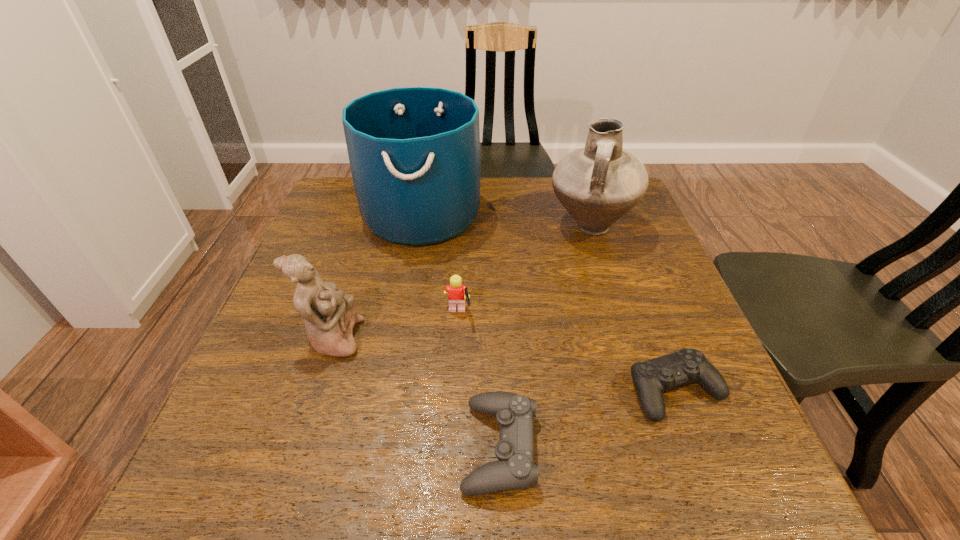
Locate an element on the screen. bucket is located at coordinates (414, 152).

You are a GUI agent. You are given a task and a screenshot of the screen. Output one action in this format:
    pyautogui.click(x=<x>, y=<y>)
    Task: Click on the pitcher
    The height and width of the screenshot is (540, 960).
    Given the screenshot: What is the action you would take?
    pyautogui.click(x=598, y=184)

Where is `figurine`? The width and height of the screenshot is (960, 540). figurine is located at coordinates (330, 316).

Identify the location of the fourth tallest object. (457, 293).

Where is `the right control`? the right control is located at coordinates coord(650,378).

You are a GUI agent. You are given a task and a screenshot of the screen. Output one action in this format:
    pyautogui.click(x=<x>, y=<y>)
    Task: Click on the left control
    The image size is (960, 540).
    Given the screenshot: What is the action you would take?
    (x=515, y=470)

Locate an element on the screen. The image size is (960, 540). vacant region located 0.230m on the right of the bucket is located at coordinates (564, 214).

This screenshot has width=960, height=540. In order to click on free point located 0.200m on the handle side of the pitcher in this screenshot , I will do `click(617, 314)`.

At what (x,y) coordinates should I click in order to perform the action: click on free space located on the front-facing side of the figurine. Please return your answer as a coordinate pair (x, y). This screenshot has height=540, width=960. Looking at the image, I should click on (401, 338).

Locate an element on the screen. This screenshot has height=540, width=960. vacant region located 0.190m in front of the fourth tallest object with the accessory visible is located at coordinates (561, 314).